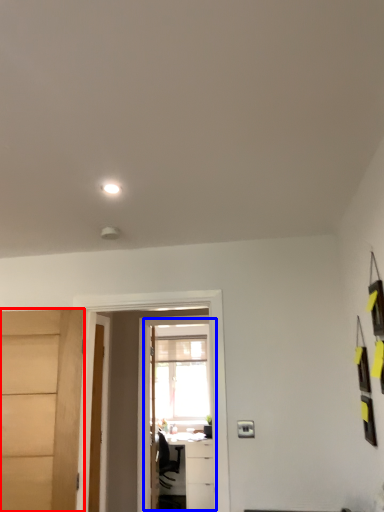
Question: Which point is closer to the camera, door (highlighted by a red box) or screen door (highlighted by a blue box)?

Choices:
 (A) door
 (B) screen door

Answer: (A)